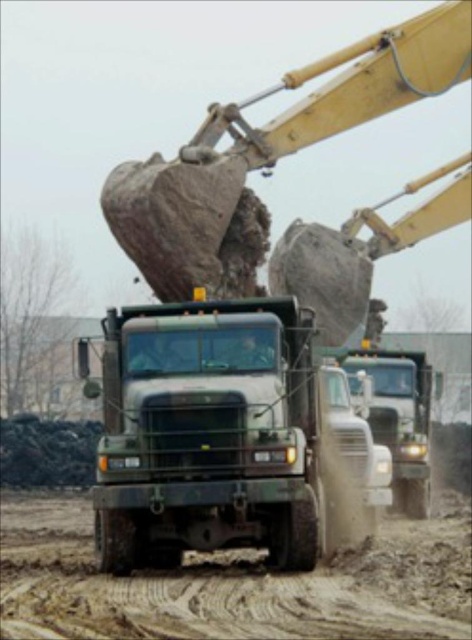
You are a safety inspector standing at the edge of the construction site. You need to ensure that the green matte truck at center and the metallic silver truck at center are at least 20 feet apart for safety regulations. Based on the scene, are they compliant with the safety distance requirement?

The green matte truck at center is 22.20 feet away from the metallic silver truck at center, which exceeds the required 20 feet distance. Therefore, they are compliant with the safety regulations.

You are a drone operator trying to capture aerial footage of the construction site. You need to adjust your drone to focus on two specific points in the image. The first point is at coordinates point (148,305) and the second is at point (367,362). Which point should you focus on first to ensure the closest object is captured clearly?

Point (148,305) is closer to the camera than point (367,362), so you should focus on point (148,305) first to capture the closest object clearly.